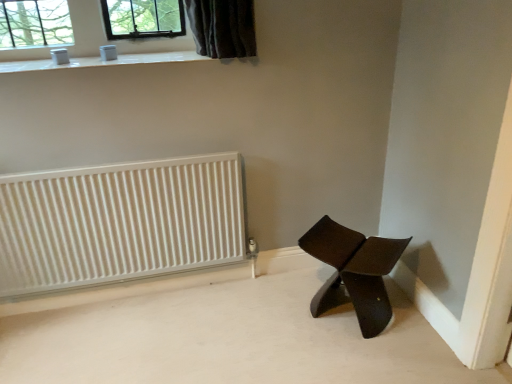
Question: In terms of width, does matte brown chair at lower right look wider or thinner when compared to white glossy window sill at upper center?

Choices:
 (A) thin
 (B) wide

Answer: (A)

Question: Considering their positions, is matte brown chair at lower right located in front of or behind white glossy window sill at upper center?

Choices:
 (A) front
 (B) behind

Answer: (A)

Question: Which object is the farthest from the white glossy window sill at upper center?

Choices:
 (A) white ribbed radiator at left
 (B) matte brown chair at lower right

Answer: (B)

Question: Estimate the real-world distances between objects in this image. Which object is closer to the white ribbed radiator at left?

Choices:
 (A) white glossy window sill at upper center
 (B) matte brown chair at lower right

Answer: (A)